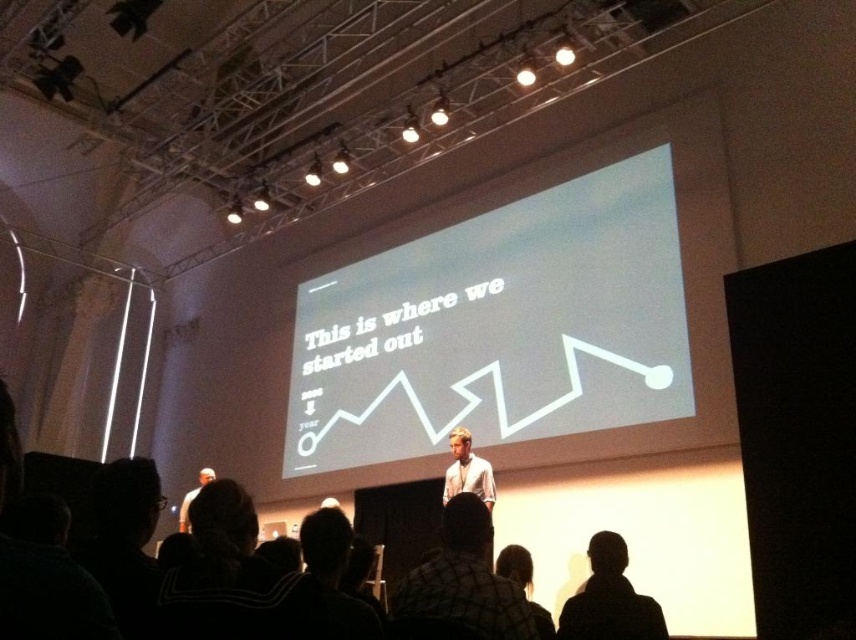
Question: Among these objects, which one is farthest from the camera?

Choices:
 (A) white matte projection screen at upper center
 (B) plaid shirt at center
 (C) dark hair at lower center
 (D) black hair at lower center

Answer: (A)

Question: Is white matte projection screen at upper center to the left of plaid shirt at center from the viewer's perspective?

Choices:
 (A) no
 (B) yes

Answer: (A)

Question: Which object appears closest to the camera in this image?

Choices:
 (A) black hair at lower center
 (B) white shirt at center
 (C) dark hair at lower center

Answer: (C)

Question: Does white matte projection screen at upper center appear on the right side of dark hair at lower center?

Choices:
 (A) no
 (B) yes

Answer: (A)

Question: Which of the following is the farthest from the observer?

Choices:
 (A) (583, 604)
 (B) (471, 220)
 (C) (182, 515)

Answer: (B)

Question: Can you confirm if black hair at lower center is positioned below dark hair at lower center?

Choices:
 (A) yes
 (B) no

Answer: (A)